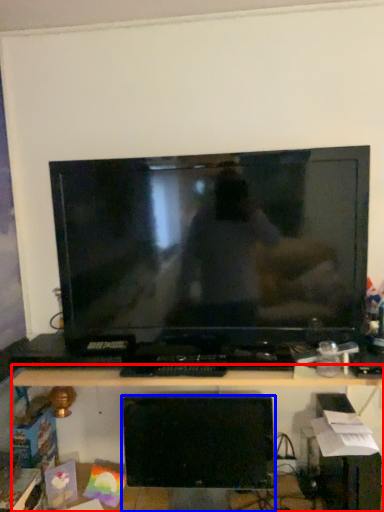
Question: Which point is closer to the camera, desk (highlighted by a red box) or computer monitor (highlighted by a blue box)?

Choices:
 (A) desk
 (B) computer monitor

Answer: (A)